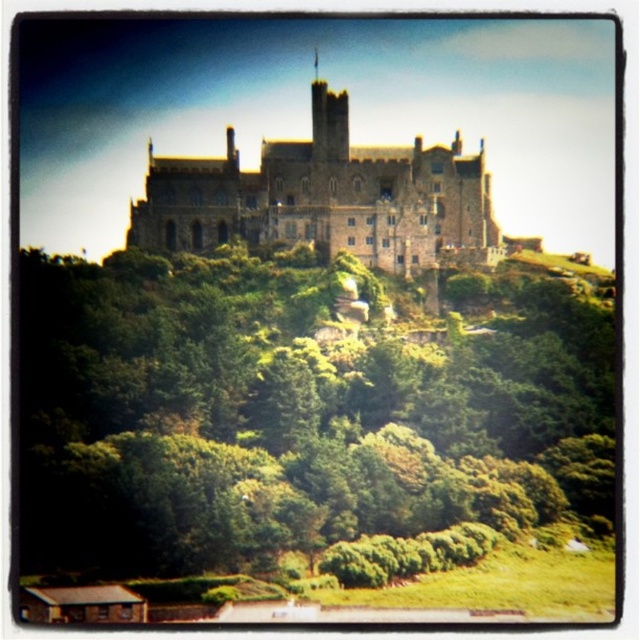
Does point (184, 509) come behind point (426, 198)?

That is False.

Which of these two, green leafy tree at upper center or brown stone castle at center, stands shorter?

Standing shorter between the two is brown stone castle at center.

Where is `green leafy tree at upper center`? The width and height of the screenshot is (640, 640). green leafy tree at upper center is located at coordinates (291, 413).